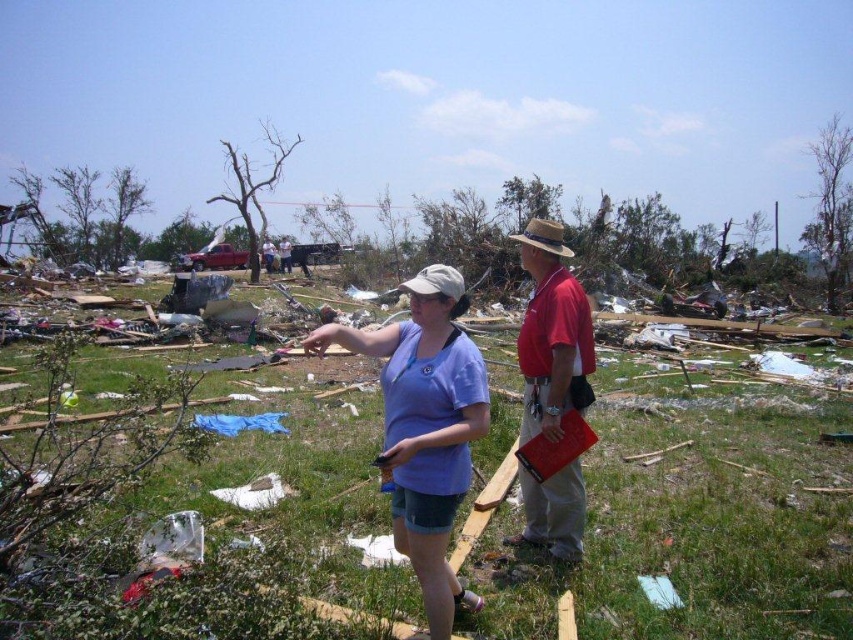
Describe the element at coordinates (425, 426) in the screenshot. I see `purple cotton shirt at center` at that location.

Does purple cotton shirt at center appear under matte blue shirt at center?

Yes.

I want to click on purple cotton shirt at center, so click(425, 426).

Which of these two, purple cotton shirt at center or red cotton shirt at center, stands shorter?

purple cotton shirt at center is shorter.

The width and height of the screenshot is (853, 640). What do you see at coordinates (425, 426) in the screenshot? I see `purple cotton shirt at center` at bounding box center [425, 426].

Identify the location of purple cotton shirt at center. The width and height of the screenshot is (853, 640). (425, 426).

At what (x,y) coordinates should I click in order to perform the action: click on purple cotton shirt at center. Please return your answer as a coordinate pair (x, y). The height and width of the screenshot is (640, 853). Looking at the image, I should click on (425, 426).

Who is lower down, red cotton shirt at center or matte blue shirt at center?

red cotton shirt at center

Which is above, red cotton shirt at center or matte blue shirt at center?

matte blue shirt at center

Who is more distant from viewer, (537,490) or (280,260)?

The point (280,260) is behind.

You are a GUI agent. You are given a task and a screenshot of the screen. Output one action in this format:
    pyautogui.click(x=<x>, y=<y>)
    Task: Click on the red cotton shirt at center
    
    Given the screenshot: What is the action you would take?
    pyautogui.click(x=552, y=333)